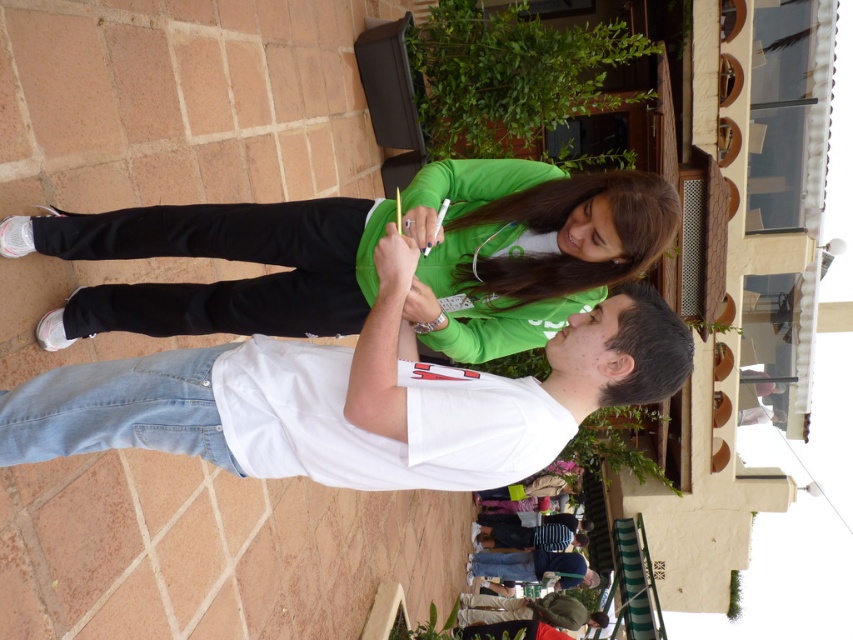
The image size is (853, 640). Identify the location of white denim jeans at center. (354, 397).